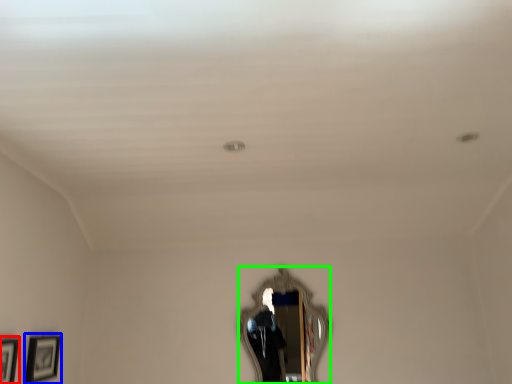
Question: Estimate the real-world distances between objects in this image. Which object is farther from picture frame (highlighted by a red box), picture frame (highlighted by a blue box) or mirror (highlighted by a green box)?

Choices:
 (A) picture frame
 (B) mirror

Answer: (B)